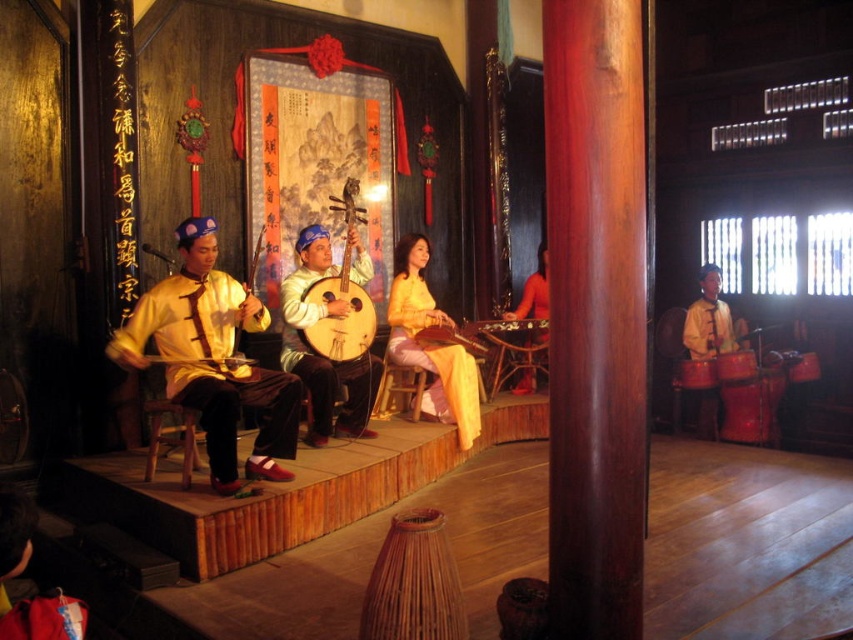
You are an audience member sitting in the front row of the stage. You want to see both the matte yellow robe at center and the shiny red drum at right clearly. Which object will appear larger to you?

The matte yellow robe at center will appear larger because it is closer to the viewer than the shiny red drum at right.

In the traditional performance setting, where exactly is the light brown wooden lute at center located in terms of coordinates?

The light brown wooden lute at center is located at coordinates point (340, 316).

You are an audience member sitting in the front row of the stage. You notice the matte yellow fabric at center and the wooden drum at center. Which object is closer to your left side?

The matte yellow fabric at center is to the left of the wooden drum at center, so it is closer to your left side.